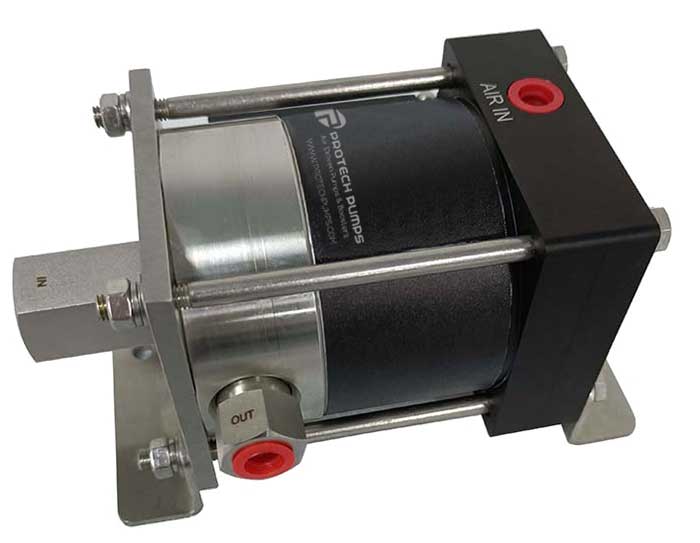
The image size is (700, 543). In order to click on rod in this screenshot , I will do `click(455, 250)`, `click(286, 94)`, `click(384, 422)`.